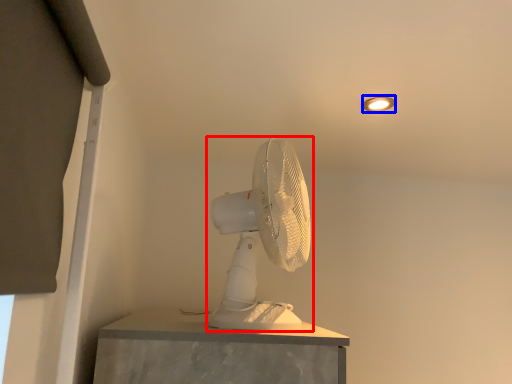
Question: Which of the following is the farthest to the observer, mechanical fan (highlighted by a red box) or light fixture (highlighted by a blue box)?

Choices:
 (A) mechanical fan
 (B) light fixture

Answer: (B)